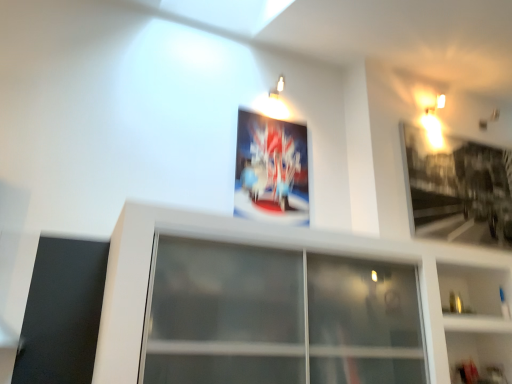
Question: Can you confirm if white glossy shelf at lower right is shorter than transparent glass window at center?

Choices:
 (A) yes
 (B) no

Answer: (B)

Question: Does white glossy shelf at lower right appear on the right side of transparent glass window at center?

Choices:
 (A) no
 (B) yes

Answer: (B)

Question: Considering the relative sizes of white glossy shelf at lower right and transparent glass window at center in the image provided, is white glossy shelf at lower right smaller than transparent glass window at center?

Choices:
 (A) yes
 (B) no

Answer: (A)

Question: Is transparent glass window at center a part of white glossy shelf at lower right?

Choices:
 (A) no
 (B) yes

Answer: (A)

Question: Is white glossy shelf at lower right wider than transparent glass window at center?

Choices:
 (A) yes
 (B) no

Answer: (B)

Question: Considering the relative sizes of white glossy shelf at lower right and transparent glass window at center in the image provided, is white glossy shelf at lower right bigger than transparent glass window at center?

Choices:
 (A) yes
 (B) no

Answer: (B)

Question: Is transparent glass window at center shorter than metallic poster at center, which is the second picture frame in right-to-left order?

Choices:
 (A) no
 (B) yes

Answer: (B)

Question: Can you confirm if transparent glass window at center is smaller than metallic poster at center, which is the second picture frame in right-to-left order?

Choices:
 (A) yes
 (B) no

Answer: (B)

Question: Does transparent glass window at center turn towards metallic poster at center, which is counted as the first picture frame, starting from the left?

Choices:
 (A) no
 (B) yes

Answer: (A)

Question: Considering the relative positions of transparent glass window at center and metallic poster at center, which is the second picture frame in right-to-left order, in the image provided, is transparent glass window at center to the right of metallic poster at center, which is the second picture frame in right-to-left order, from the viewer's perspective?

Choices:
 (A) yes
 (B) no

Answer: (B)

Question: Is transparent glass window at center to the left of metallic poster at center, which is counted as the first picture frame, starting from the left, from the viewer's perspective?

Choices:
 (A) no
 (B) yes

Answer: (B)

Question: Can you confirm if transparent glass window at center is thinner than metallic poster at center, which is the second picture frame in right-to-left order?

Choices:
 (A) yes
 (B) no

Answer: (B)

Question: Can you see transparent glass window at center touching white glossy shelf at lower right?

Choices:
 (A) no
 (B) yes

Answer: (A)